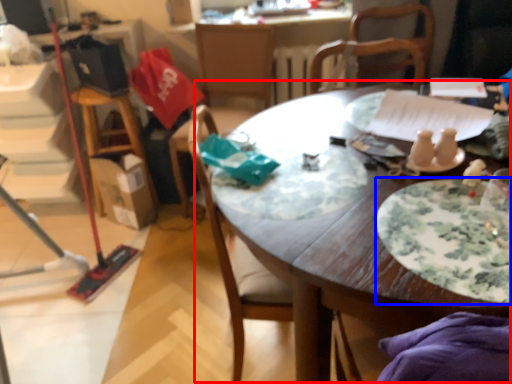
Question: Which object is closer to the camera taking this photo, table (highlighted by a red box) or plate (highlighted by a blue box)?

Choices:
 (A) table
 (B) plate

Answer: (A)